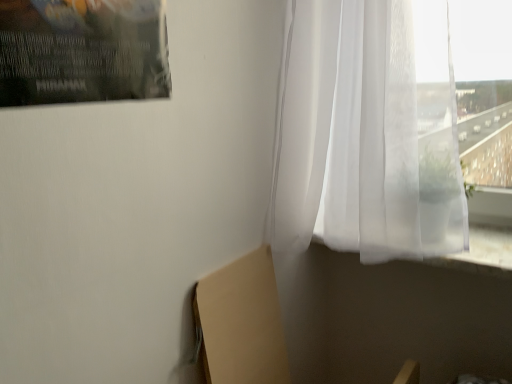
Describe the element at coordinates (241, 323) in the screenshot. I see `beige cardboard at lower left` at that location.

Image resolution: width=512 pixels, height=384 pixels. In order to click on beige cardboard at lower left in this screenshot , I will do `click(241, 323)`.

What is the approximate height of beige cardboard at lower left?

beige cardboard at lower left is 18.06 inches tall.

This screenshot has height=384, width=512. What do you see at coordinates (367, 132) in the screenshot? I see `translucent white curtain at upper right` at bounding box center [367, 132].

Find the location of `translucent white curtain at upper right`. translucent white curtain at upper right is located at coordinates (367, 132).

In order to face translucent white curtain at upper right, should I rotate leftwards or rightwards?

You should rotate right by 15.715 degrees.

Measure the distance between translucent white curtain at upper right and camera.

The distance of translucent white curtain at upper right from camera is 37.76 inches.

Where is `beige cardboard at lower left`? beige cardboard at lower left is located at coordinates (241, 323).

Which object is positioned more to the left, translucent white curtain at upper right or beige cardboard at lower left?

Positioned to the left is beige cardboard at lower left.

Is translucent white curtain at upper right closer to the viewer compared to beige cardboard at lower left?

That is True.

Is point (286, 88) less distant than point (270, 295)?

No.

From the image's perspective, is translucent white curtain at upper right located beneath beige cardboard at lower left?

Incorrect, from the image's perspective, translucent white curtain at upper right is higher than beige cardboard at lower left.

From a real-world perspective, is translucent white curtain at upper right physically located above or below beige cardboard at lower left?

From a real-world perspective, translucent white curtain at upper right is physically above beige cardboard at lower left.

Considering the sizes of objects translucent white curtain at upper right and beige cardboard at lower left in the image provided, who is wider, translucent white curtain at upper right or beige cardboard at lower left?

Wider between the two is translucent white curtain at upper right.

Does translucent white curtain at upper right have a greater height compared to beige cardboard at lower left?

Indeed, translucent white curtain at upper right has a greater height compared to beige cardboard at lower left.

Who is bigger, translucent white curtain at upper right or beige cardboard at lower left?

Bigger between the two is translucent white curtain at upper right.

Is translucent white curtain at upper right completely or partially outside of beige cardboard at lower left?

Indeed, translucent white curtain at upper right is completely outside beige cardboard at lower left.

Can you see translucent white curtain at upper right touching beige cardboard at lower left?

translucent white curtain at upper right and beige cardboard at lower left are clearly separated.

Is translucent white curtain at upper right facing away from beige cardboard at lower left?

No, translucent white curtain at upper right is not facing the opposite direction of beige cardboard at lower left.

At what (x,y) coordinates should I click in order to perform the action: click on cardboard box below the translucent white curtain at upper right (from a real-world perspective). Please return your answer as a coordinate pair (x, y). This screenshot has width=512, height=384. Looking at the image, I should click on (241, 323).

Is beige cardboard at lower left to the left of translucent white curtain at upper right from the viewer's perspective?

Yes, beige cardboard at lower left is to the left of translucent white curtain at upper right.

Is beige cardboard at lower left in front of translucent white curtain at upper right?

No, the depth of beige cardboard at lower left is greater than that of translucent white curtain at upper right.

Between point (205, 332) and point (316, 97), which one is positioned in front?

The point (205, 332) is in front.

From the image's perspective, which is above, beige cardboard at lower left or translucent white curtain at upper right?

translucent white curtain at upper right.

From a real-world perspective, is beige cardboard at lower left located higher than translucent white curtain at upper right?

No.

Which object is wider, beige cardboard at lower left or translucent white curtain at upper right?

With larger width is translucent white curtain at upper right.

Does beige cardboard at lower left have a lesser height compared to translucent white curtain at upper right?

Correct, beige cardboard at lower left is not as tall as translucent white curtain at upper right.

Between beige cardboard at lower left and translucent white curtain at upper right, which one has larger size?

translucent white curtain at upper right is bigger.

Is beige cardboard at lower left not within translucent white curtain at upper right?

Yes.

Is beige cardboard at lower left directly adjacent to translucent white curtain at upper right?

beige cardboard at lower left and translucent white curtain at upper right are not in contact.

Is beige cardboard at lower left facing away from translucent white curtain at upper right?

No.

How different are the orientations of beige cardboard at lower left and translucent white curtain at upper right in degrees?

beige cardboard at lower left and translucent white curtain at upper right are facing 90.7 degrees away from each other.

This screenshot has width=512, height=384. In order to click on cardboard box below the translucent white curtain at upper right (from the image's perspective) in this screenshot , I will do `click(241, 323)`.

Locate an element on the screen. The image size is (512, 384). curtain to the right of beige cardboard at lower left is located at coordinates (367, 132).

Find the location of `curtain in front of the beige cardboard at lower left`. curtain in front of the beige cardboard at lower left is located at coordinates (367, 132).